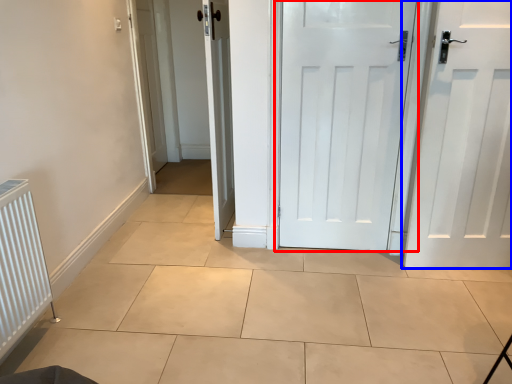
Question: Which object appears farthest to the camera in this image, door (highlighted by a red box) or door (highlighted by a blue box)?

Choices:
 (A) door
 (B) door

Answer: (A)